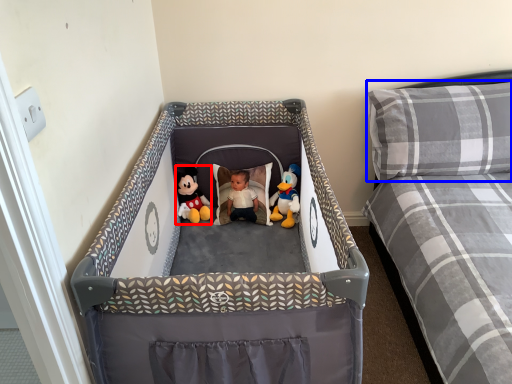
Question: Among these objects, which one is nearest to the camera, toy (highlighted by a red box) or pillow (highlighted by a blue box)?

Choices:
 (A) toy
 (B) pillow

Answer: (B)